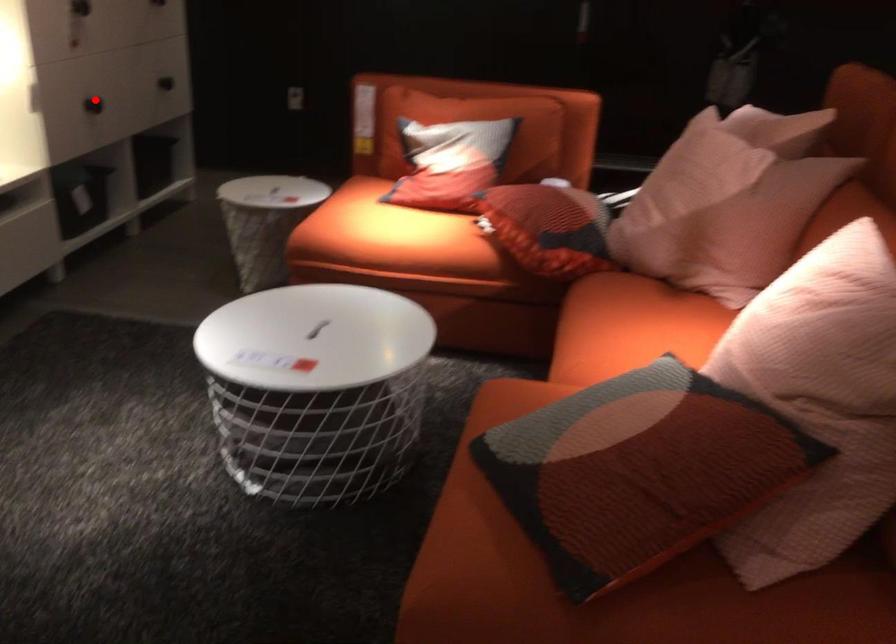
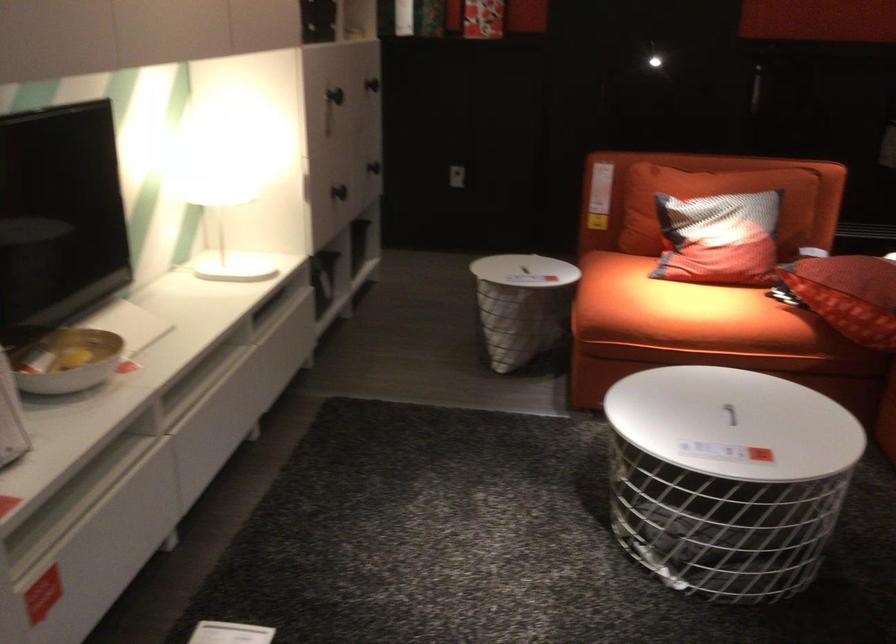
Locate, in the second image, the point that corresponds to the highlighted location in the first image.

(339, 192)